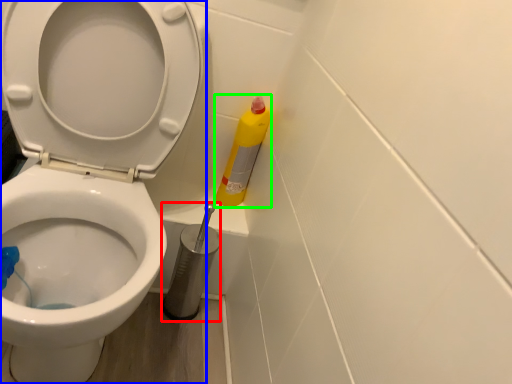
Question: Based on their relative distances, which object is farther from brush (highlighted by a red box)? Choose from toilet (highlighted by a blue box) and cleaning product (highlighted by a green box).

Choices:
 (A) toilet
 (B) cleaning product

Answer: (A)